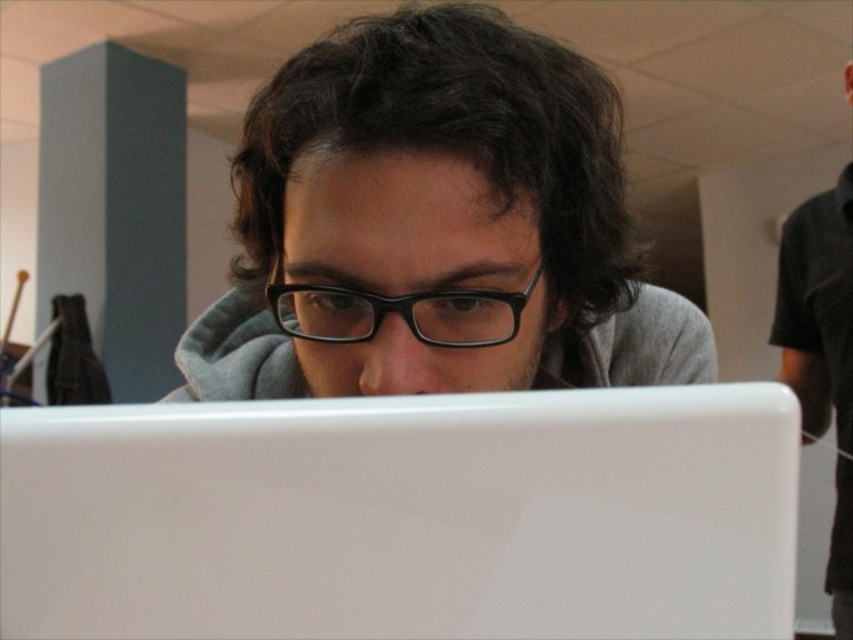
Question: Which object is positioned closest to the black matte shirt at right?

Choices:
 (A) matte black glasses at center
 (B) white glossy laptop at center
 (C) black plastic glasses at center

Answer: (A)

Question: Is white glossy laptop at center to the left of matte black glasses at center from the viewer's perspective?

Choices:
 (A) yes
 (B) no

Answer: (A)

Question: Is black matte shirt at right further to camera compared to black plastic glasses at center?

Choices:
 (A) yes
 (B) no

Answer: (A)

Question: Among these points, which one is nearest to the camera?

Choices:
 (A) (396, 374)
 (B) (546, 563)

Answer: (B)

Question: Which point is closer to the camera?

Choices:
 (A) matte black glasses at center
 (B) black matte shirt at right
 (C) white glossy laptop at center

Answer: (C)

Question: Can you confirm if matte black glasses at center is smaller than black matte shirt at right?

Choices:
 (A) yes
 (B) no

Answer: (A)